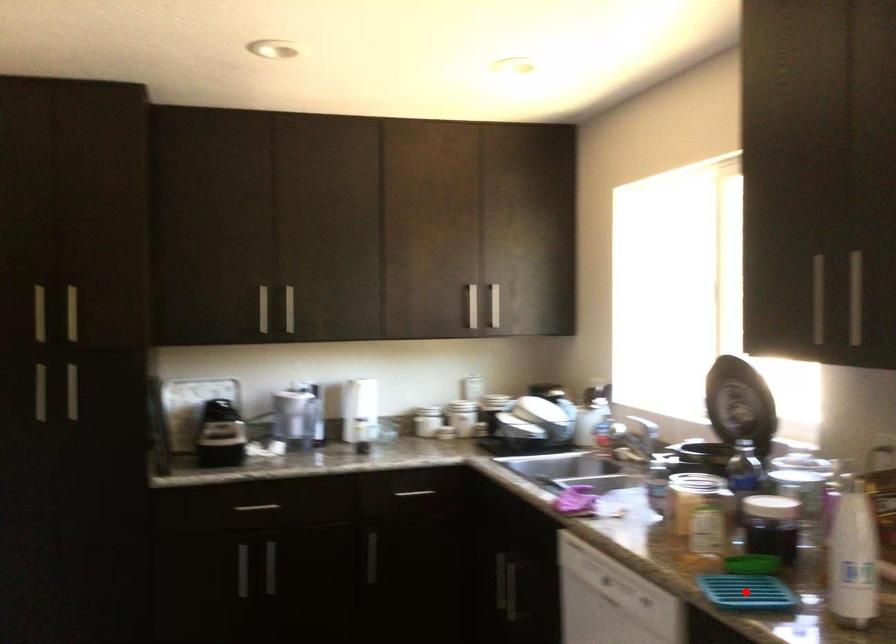
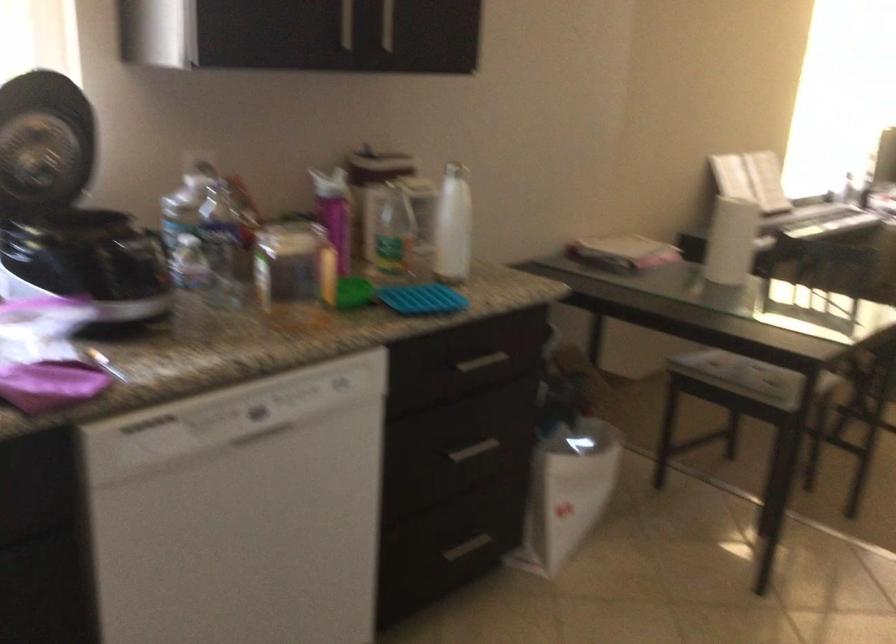
Question: I am providing you with two images of the same scene from different viewpoints. A red point is marked on the first image. At the location where the point appears in image 1, is it still visible in image 2?

Choices:
 (A) Yes
 (B) No

Answer: (B)